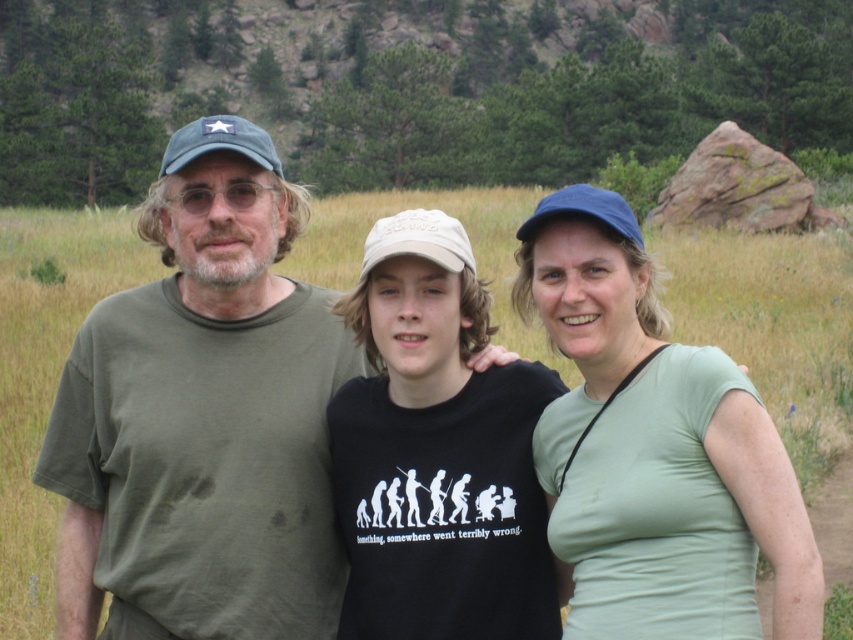
Question: Is green cotton t-shirt at left to the right of green matte shirt at center from the viewer's perspective?

Choices:
 (A) no
 (B) yes

Answer: (A)

Question: Which point is farther to the camera?

Choices:
 (A) (590, 550)
 (B) (326, 476)

Answer: (B)

Question: Which point is farther to the camera?

Choices:
 (A) (517, 230)
 (B) (196, 538)

Answer: (A)

Question: Which point is farther to the camera?

Choices:
 (A) (x=235, y=340)
 (B) (x=746, y=454)

Answer: (A)

Question: Is green cotton t-shirt at left thinner than green matte shirt at center?

Choices:
 (A) yes
 (B) no

Answer: (A)

Question: Is the position of green cotton t-shirt at left more distant than that of green matte shirt at center?

Choices:
 (A) no
 (B) yes

Answer: (B)